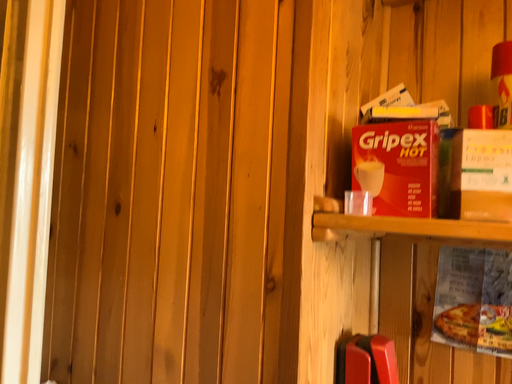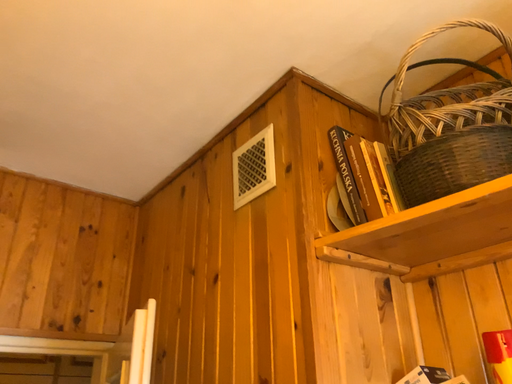
Question: How did the camera likely rotate when shooting the video?

Choices:
 (A) rotated left
 (B) rotated right

Answer: (A)